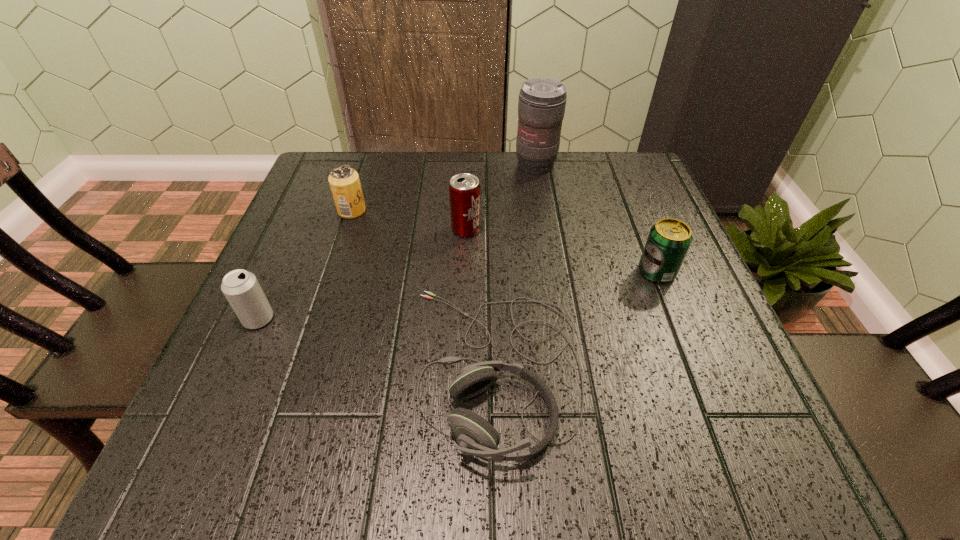
Locate an element on the screen. Image resolution: width=960 pixels, height=540 pixels. unoccupied position between the rightmost object and the leftmost object is located at coordinates (458, 295).

The image size is (960, 540). I want to click on free space between the second farthest beer can and the telephoto lens, so click(501, 198).

Locate an element on the screen. vacant region between the rightmost object and the third nearest beer can is located at coordinates (562, 251).

Locate an element on the screen. This screenshot has height=540, width=960. vacant space that's between the telephoto lens and the nearest beer can is located at coordinates (397, 242).

In order to click on unoccupied position between the headset and the fourth nearest object in this screenshot , I will do [481, 299].

Where is `vacant area that lies between the tallest object and the rightmost beer can`? Image resolution: width=960 pixels, height=540 pixels. vacant area that lies between the tallest object and the rightmost beer can is located at coordinates (596, 219).

Image resolution: width=960 pixels, height=540 pixels. Identify the location of free spot between the fifth nearest object and the shortest object. (424, 289).

Identify the location of free space between the tallest object and the second beer can from right to left. The height and width of the screenshot is (540, 960). (501, 198).

Where is `free space between the nearest beer can and the farthest beer can`? free space between the nearest beer can and the farthest beer can is located at coordinates (305, 265).

The image size is (960, 540). In order to click on free spot between the rightmost beer can and the second beer can from right to left in this screenshot , I will do `click(562, 251)`.